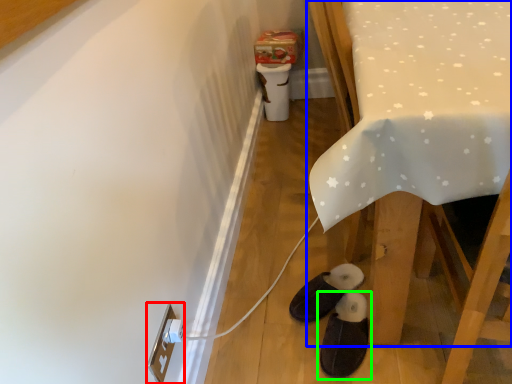
Question: Which object is positioned closest to electric outlet (highlighted by a red box)? Select from furniture (highlighted by a blue box) and footwear (highlighted by a green box).

Choices:
 (A) furniture
 (B) footwear

Answer: (B)